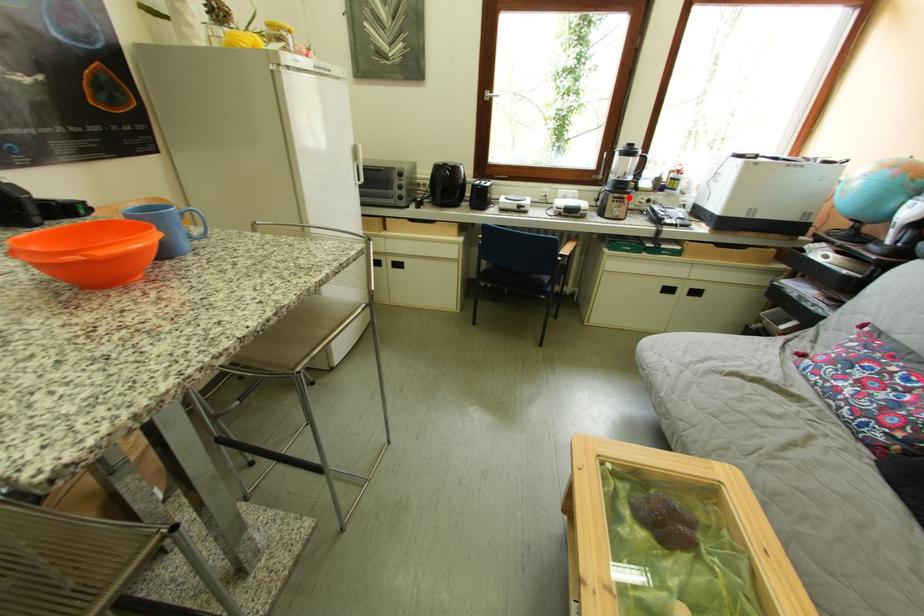
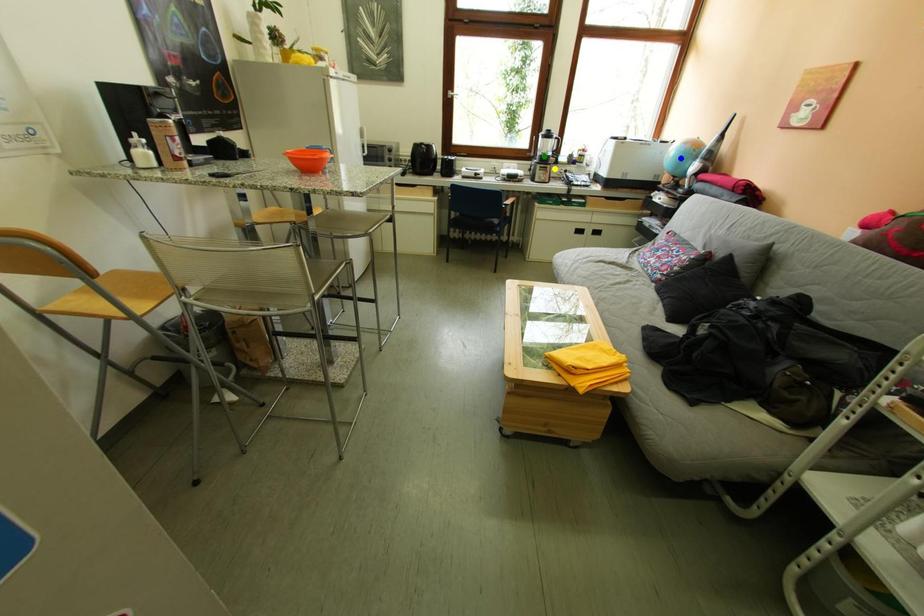
Question: I am providing you with two images of the same scene from different viewpoints. A red point is marked on the first image. You are given multiple points on the second image. Which point in image 2 represents the same 3d spot as the red point in image 1?

Choices:
 (A) yellow point
 (B) green point
 (C) blue point

Answer: (A)